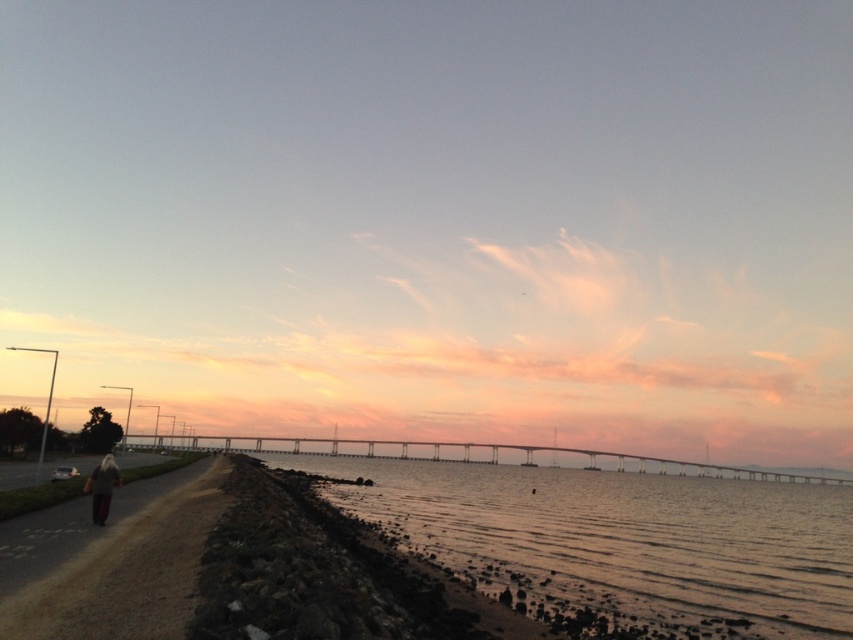
Measure the distance between sandy beach at lower center and camera.

They are 18.45 meters apart.

Is point (408, 465) closer to viewer compared to point (102, 472)?

That is False.

This screenshot has width=853, height=640. I want to click on sandy beach at lower center, so click(619, 540).

Is sandy beach at lower center shorter than dirt/gravel path at lower left?

Incorrect, sandy beach at lower center's height does not fall short of dirt/gravel path at lower left's.

Is sandy beach at lower center smaller than dirt/gravel path at lower left?

No, sandy beach at lower center is not smaller than dirt/gravel path at lower left.

Is point (480, 516) positioned behind point (119, 611)?

That is True.

Locate an element on the screen. This screenshot has height=640, width=853. sandy beach at lower center is located at coordinates (619, 540).

How far apart are dirt/gravel path at lower left and dark gray fabric jacket at lower left?

dirt/gravel path at lower left is 5.79 meters away from dark gray fabric jacket at lower left.

Is point (10, 609) farther from viewer compared to point (100, 474)?

No.

The height and width of the screenshot is (640, 853). What are the coordinates of `dirt/gravel path at lower left` in the screenshot? It's located at (125, 572).